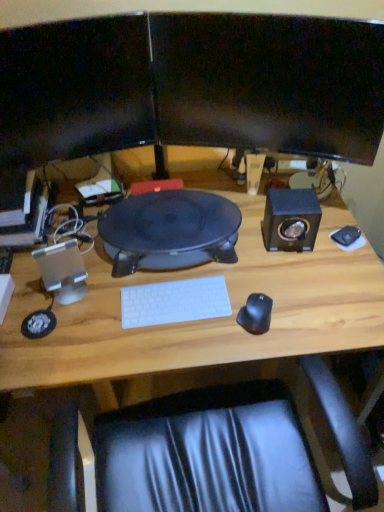
Identify the location of free location to the right of black matte speaker at right, arranged as the second speaker when ordered from the bottom. (339, 246).